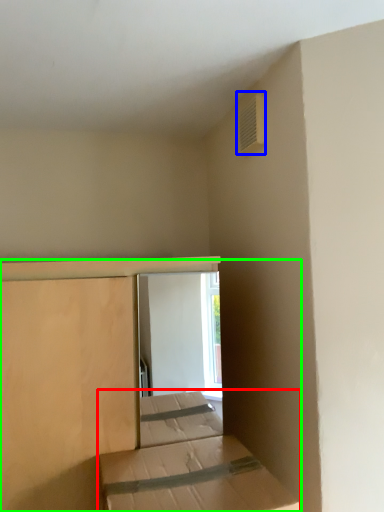
Question: Which object is the closest to the bed (highlighted by a red box)? Choose among these: air conditioning (highlighted by a blue box) or bed (highlighted by a green box).

Choices:
 (A) air conditioning
 (B) bed

Answer: (B)